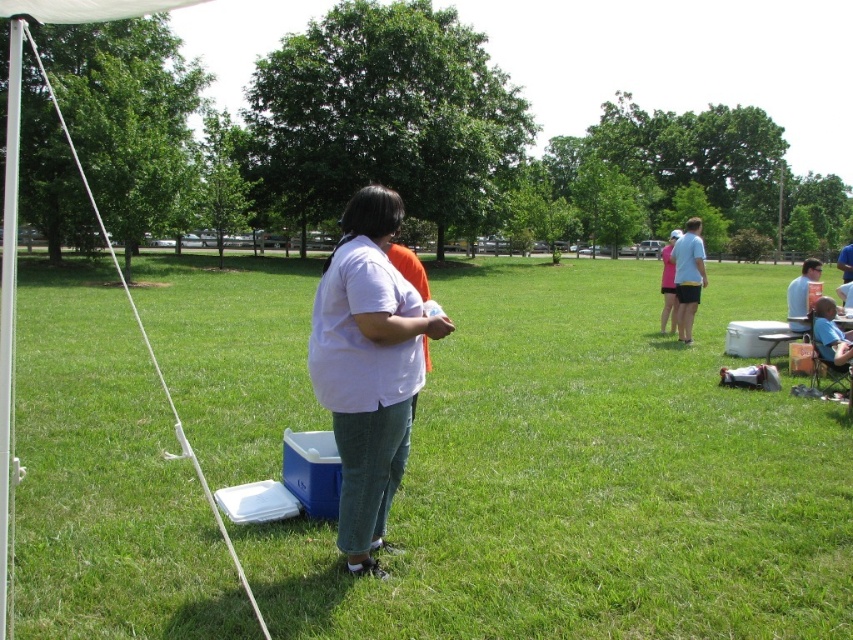
You are planning to place a picnic blanket on the green grass at center. The blanket is 3 meters long. Will it fit without overlapping any nearby objects?

The green grass at center has a width of 3.54 meters, so the 3 meter long blanket will fit without overlapping any nearby objects.

You are a photographer at the park and want to take a photo of the light blue shirt at center and the blue fabric chair at lower right. Which object is positioned more to the left in the frame?

The blue fabric chair at lower right is positioned more to the left than the light blue shirt at center.

You are a photographer trying to capture a clear photo of the green grass at center and the white matte shirt at center. Which object should you focus on first to ensure both are in focus?

The green grass at center is in front of the white matte shirt at center, so you should focus on the green grass at center first to ensure both are in focus.